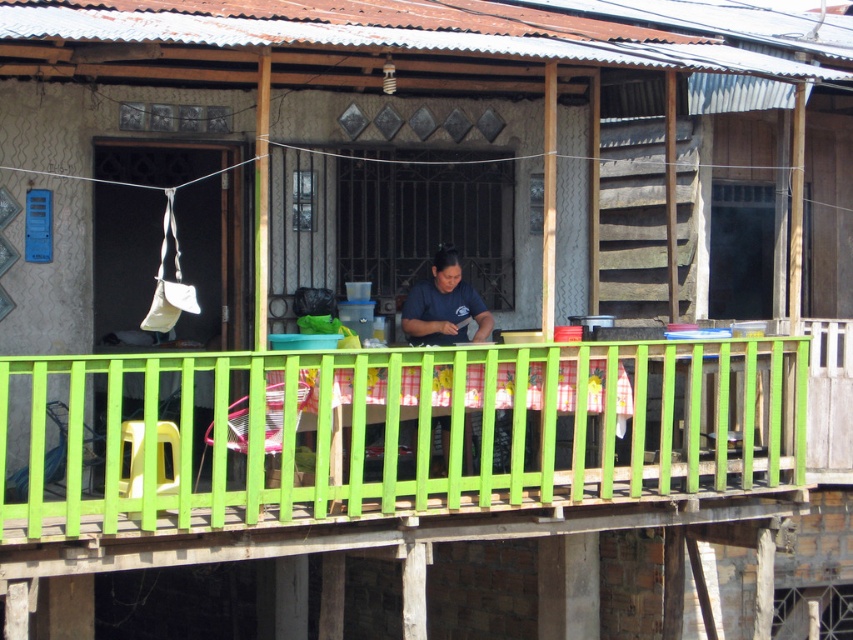
You are standing on the balcony and want to place a small potted plant exactly at the point marked as point (390, 429). What object will the potted plant be placed next to?

The potted plant will be placed next to the green plastic balustrade at center, as point (390, 429) corresponds to that object.

You are standing on the balcony and want to place a small potted plant between the green plastic balustrade at center and the dark blue shirt at center. Which object should the plant be closer to based on their positions?

The green plastic balustrade at center is positioned under the dark blue shirt at center, so the plant should be placed closer to the green plastic balustrade at center since it is underneath the dark blue shirt at center.

You are standing on the balcony and want to grab the dark blue shirt at center without moving from your spot. Is the green plastic balustrade at center in your way?

The green plastic balustrade at center is closer to the viewer than the dark blue shirt at center, so the balustrade is between you and the shirt, blocking your path.